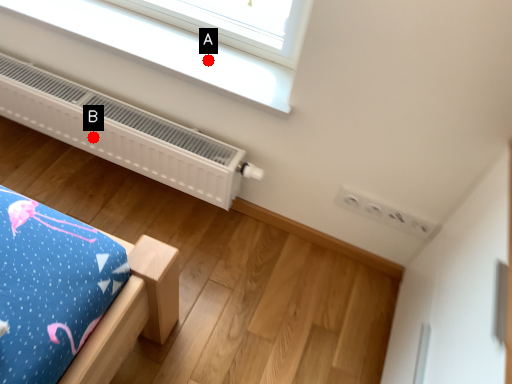
Question: Two points are circled on the image, labeled by A and B beside each circle. Which point is closer to the camera taking this photo?

Choices:
 (A) A is closer
 (B) B is closer

Answer: (A)